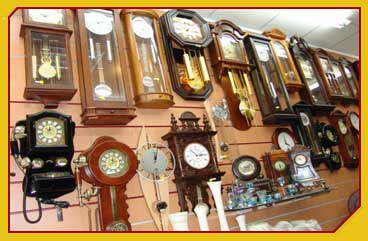
The width and height of the screenshot is (368, 241). Identify the location of glass case. (108, 73), (65, 77), (156, 80), (275, 81), (317, 87), (283, 65), (352, 80), (344, 88).